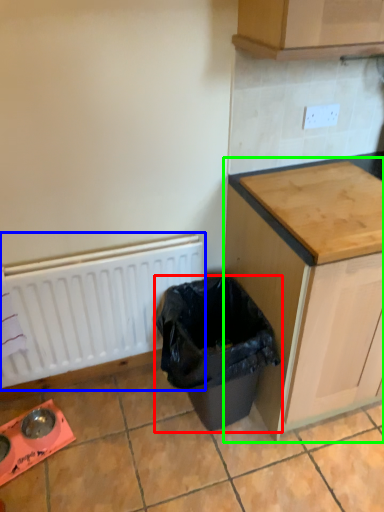
Question: Estimate the real-world distances between objects in this image. Which object is closer to waste container (highlighted by a red box), radiator (highlighted by a blue box) or cabinetry (highlighted by a green box)?

Choices:
 (A) radiator
 (B) cabinetry

Answer: (B)